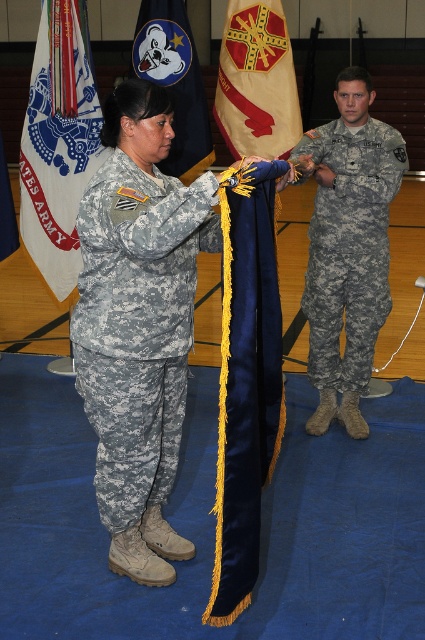
Question: Can you confirm if white fabric flag at left is positioned below beige fabric flag at center?

Choices:
 (A) no
 (B) yes

Answer: (B)

Question: Which of the following is the closest to the observer?

Choices:
 (A) (356, 216)
 (B) (144, 422)

Answer: (B)

Question: Among these points, which one is nearest to the camera?

Choices:
 (A) (187, 152)
 (B) (76, 115)
 (C) (401, 170)
 (D) (240, 29)

Answer: (C)

Question: Where is camouflage fabric uniform at right located in relation to white fabric flag at left in the image?

Choices:
 (A) above
 (B) below

Answer: (B)

Question: Considering the relative positions of camouflage fabric uniform at center and camouflage fabric uniform at right in the image provided, where is camouflage fabric uniform at center located with respect to camouflage fabric uniform at right?

Choices:
 (A) left
 (B) right

Answer: (A)

Question: Based on their relative distances, which object is farther from the blue felt flag at upper center?

Choices:
 (A) white fabric flag at left
 (B) camouflage fabric uniform at right

Answer: (B)